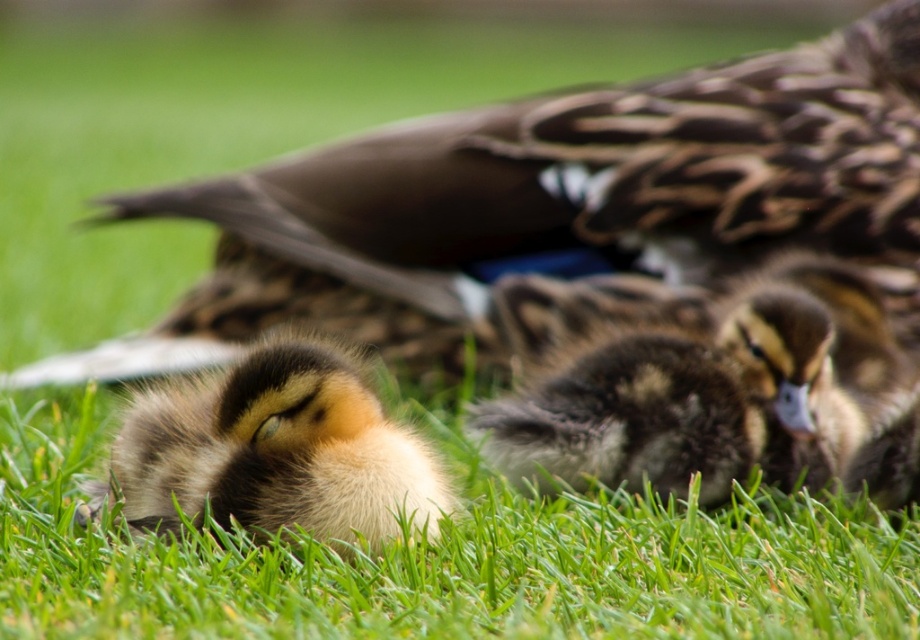
You are a photographer trying to capture a closeup of the ducklings. You notice two points marked in the image at coordinates point (516, 461) and point (259, 436). Which point is closer to the camera?

Point (259, 436) is closer to the camera because point (516, 461) is behind it.

You are a wildlife photographer trying to capture a closeup shot of the brown fluffy duckling at center and the soft brown downy duckling at lower left. Based on their sizes, which duckling should you focus on to ensure it fits entirely within your camera frame without cropping?

The brown fluffy duckling at center is wider than the soft brown downy duckling at lower left, so focusing on the brown fluffy duckling at center ensures it fits within the frame without cropping since it is larger.

You are a photographer trying to capture a closeup of the brown fluffy duckling at center and the soft brown downy duckling at lower left. Which duckling is located to the right of the other?

The brown fluffy duckling at center is positioned on the right side of soft brown downy duckling at lower left.